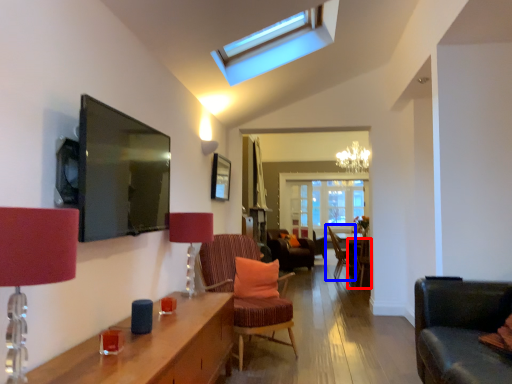
Question: Which object is closer to the camera taking this photo, chair (highlighted by a red box) or chair (highlighted by a blue box)?

Choices:
 (A) chair
 (B) chair

Answer: (A)